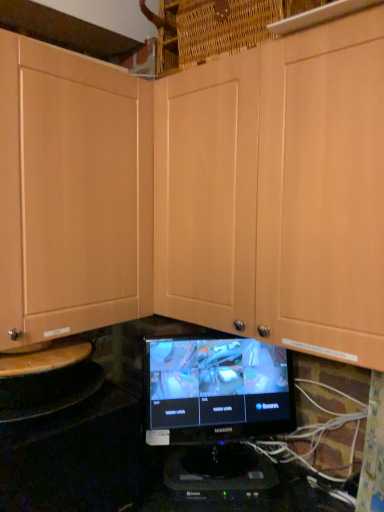
Question: From the image's perspective, is black plastic monitor at center beneath matte wood cabinet at center?

Choices:
 (A) yes
 (B) no

Answer: (A)

Question: Is black plastic monitor at center not close to matte wood cabinet at center?

Choices:
 (A) no
 (B) yes

Answer: (A)

Question: Does black plastic monitor at center turn towards matte wood cabinet at center?

Choices:
 (A) yes
 (B) no

Answer: (B)

Question: From a real-world perspective, is black plastic monitor at center over matte wood cabinet at center?

Choices:
 (A) yes
 (B) no

Answer: (B)

Question: Is black plastic monitor at center to the right of matte wood cabinet at center from the viewer's perspective?

Choices:
 (A) yes
 (B) no

Answer: (B)

Question: From the image's perspective, is black plastic monitor at center above matte wood cabinet at center?

Choices:
 (A) no
 (B) yes

Answer: (A)

Question: Are black glossy monitor at center and black plastic monitor at center making contact?

Choices:
 (A) no
 (B) yes

Answer: (A)

Question: Is black glossy monitor at center aimed at black plastic monitor at center?

Choices:
 (A) no
 (B) yes

Answer: (A)

Question: Does black glossy monitor at center have a lesser height compared to black plastic monitor at center?

Choices:
 (A) yes
 (B) no

Answer: (B)

Question: Can you confirm if black glossy monitor at center is taller than black plastic monitor at center?

Choices:
 (A) yes
 (B) no

Answer: (A)

Question: From the image's perspective, is black glossy monitor at center beneath black plastic monitor at center?

Choices:
 (A) no
 (B) yes

Answer: (A)

Question: Is black glossy monitor at center at the right side of black plastic monitor at center?

Choices:
 (A) yes
 (B) no

Answer: (A)

Question: Is black plastic monitor at center wider than black glossy monitor at center?

Choices:
 (A) yes
 (B) no

Answer: (A)